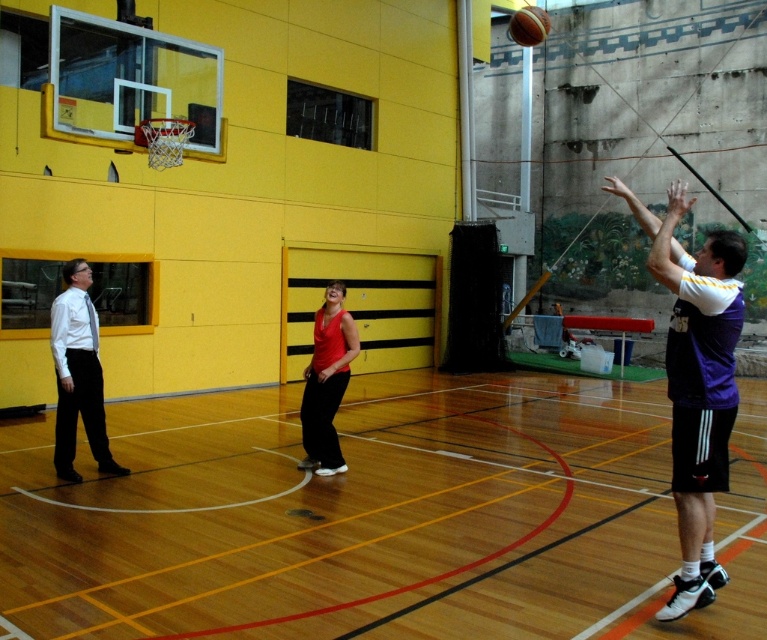
Does point (754, 410) come closer to viewer compared to point (705, 579)?

No, (754, 410) is behind (705, 579).

Measure the distance between point [40,545] and camera.

5.92 meters

Find the location of a particular element. The image size is (767, 640). wooden floor at center is located at coordinates (377, 516).

From the picture: Does white shirt at left appear on the right side of matte red tank top at center?

In fact, white shirt at left is to the left of matte red tank top at center.

Which is behind, point (56, 432) or point (338, 394)?

The point (338, 394) is more distant.

Image resolution: width=767 pixels, height=640 pixels. I want to click on white shirt at left, so click(x=78, y=374).

Measure the distance from purple jersey at upper right to rubber textured basketball at upper center.

A distance of 18.35 meters exists between purple jersey at upper right and rubber textured basketball at upper center.

Is purple jersey at upper right wider than rubber textured basketball at upper center?

In fact, purple jersey at upper right might be narrower than rubber textured basketball at upper center.

Is point (663, 282) less distant than point (548, 22)?

That is True.

At what (x,y) coordinates should I click in order to perform the action: click on purple jersey at upper right. Please return your answer as a coordinate pair (x, y). The image size is (767, 640). Looking at the image, I should click on (695, 381).